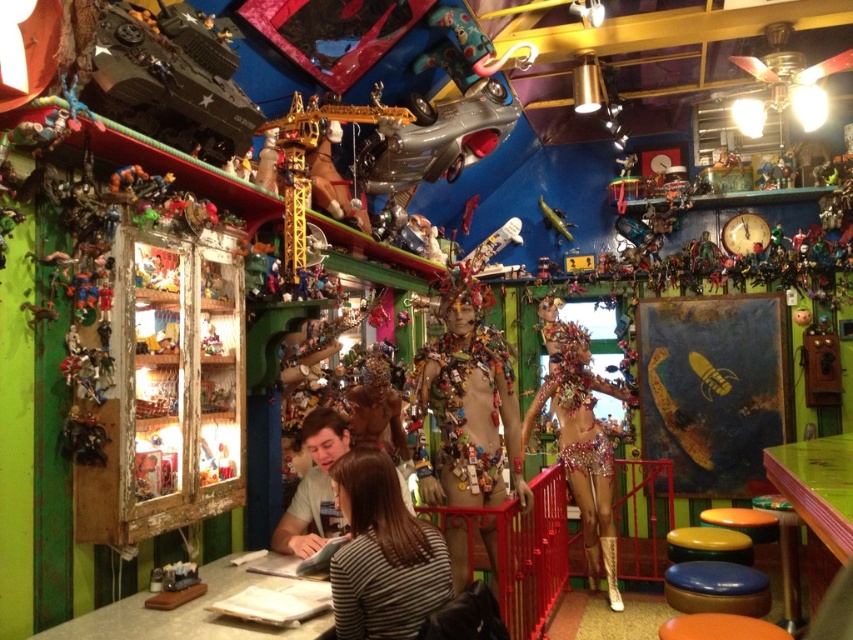
You are a customer in this quirky shop and need to sit down. You see a blue leather stool at lower right and a yellow rubber stool at lower right. Which stool is taller and therefore might be more comfortable for you?

The blue leather stool at lower right is taller than the yellow rubber stool at lower right, so it might be more comfortable for sitting.

Looking at this image, you are a customer in this quirky shop and need to sit down. You see a blue leather stool at lower right and a yellow rubber stool at lower right. Can you sit on both stools at the same time? Explain why or why not.

The blue leather stool at lower right is 32.05 centimeters from the yellow rubber stool at lower right. Since the distance between them is only 32.05 cm, it would be physically challenging to sit on both stools simultaneously as they are too close to each other.

You are a customer in this quirky shop and want to sit down. You see a blue leather stool at lower right and a yellow rubber stool at lower right. Which stool is closer to you?

The blue leather stool at lower right is closer to you because it is in front of the yellow rubber stool at lower right.